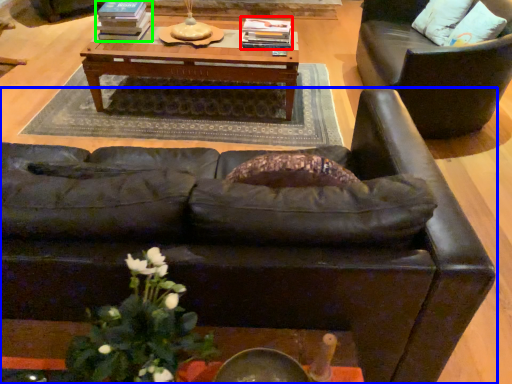
Question: Which object is the farthest from book (highlighted by a red box)? Choose among these: studio couch (highlighted by a blue box) or book (highlighted by a green box).

Choices:
 (A) studio couch
 (B) book

Answer: (A)